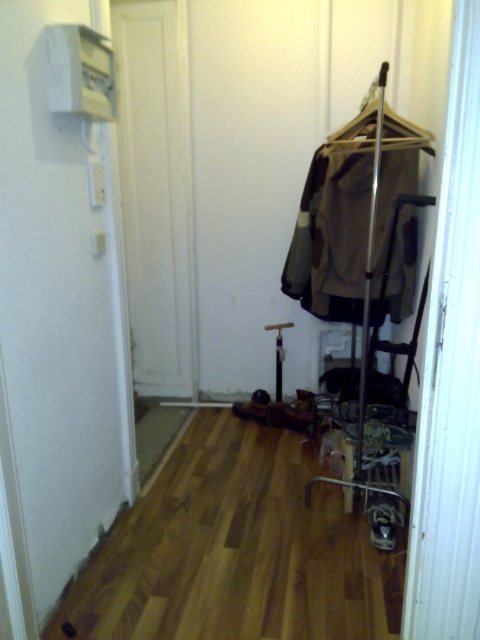
You are a delivery person carrying a large package and need to navigate through the hallway. You see the matte brown coat rack at center and the metallic silver hanger at upper center. Which object is closer to you as you face the hallway?

The matte brown coat rack at center is closer to you because the metallic silver hanger at upper center is behind it.

In the scene shown: You are standing in the hallway and want to place a small potted plant between the natural wood floor at lower center and the brown fabric coat at center. Based on their positions, which object should the plant be closer to?

The natural wood floor at lower center is positioned on the left side of brown fabric coat at center, so the plant should be placed closer to the natural wood floor at lower center to be between them.

You are a cleaning robot with a width of 2 feet. You are in the hallway and need to move from the natural wood floor at lower center to the matte brown coat rack at center. Can you fit through the space between them?

The distance between the natural wood floor at lower center and the matte brown coat rack at center is 3.59 feet. Since the robot is 2 feet wide, it can easily navigate through the space as the distance is sufficient for its width.